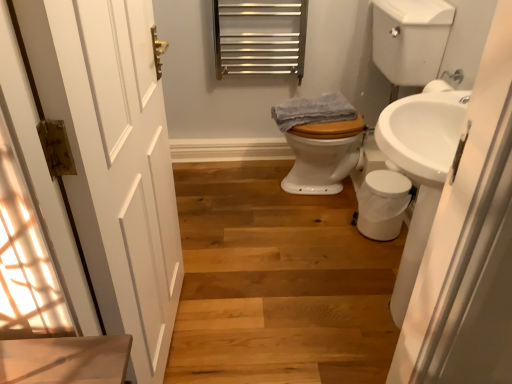
Where is `free spot in front of white glossy toilet at center`? This screenshot has width=512, height=384. free spot in front of white glossy toilet at center is located at coordinates (322, 253).